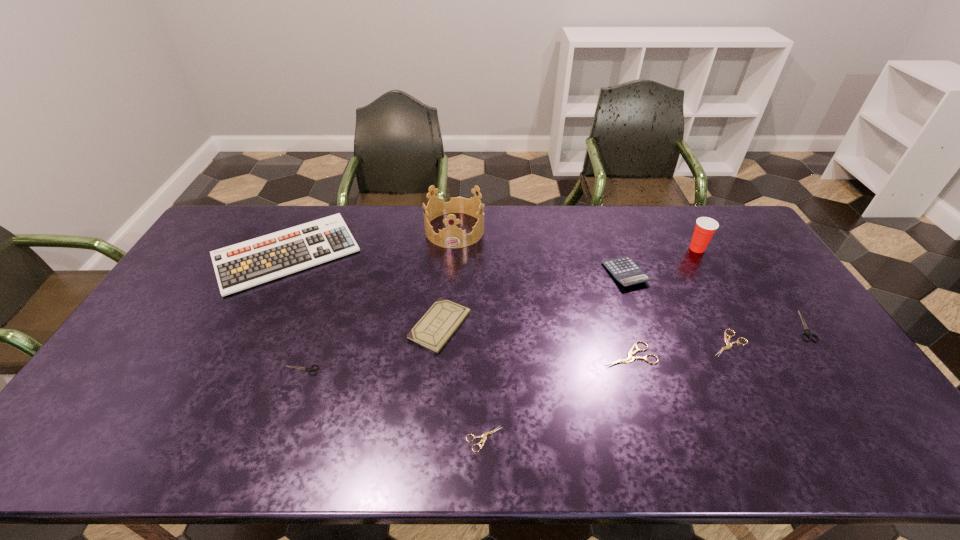
The height and width of the screenshot is (540, 960). In order to click on tiara in this screenshot , I will do pyautogui.click(x=453, y=237).

Find the location of `Dixie cup`. Dixie cup is located at coordinates (705, 227).

Locate an element on the screen. The width and height of the screenshot is (960, 540). red Dixie cup is located at coordinates coord(705,227).

Where is `the third tallest object`? This screenshot has height=540, width=960. the third tallest object is located at coordinates (243, 265).

Image resolution: width=960 pixels, height=540 pixels. I want to click on white computer keyboard, so click(243, 265).

Image resolution: width=960 pixels, height=540 pixels. I want to click on calculator, so click(623, 269).

At what (x,y) coordinates should I click in order to perform the action: click on checkbook. Please return your answer as a coordinate pair (x, y). This screenshot has height=540, width=960. Looking at the image, I should click on (433, 330).

The image size is (960, 540). I want to click on the farther black shears, so [807, 332].

You are a GUI agent. You are given a task and a screenshot of the screen. Output one action in this format:
    pyautogui.click(x=<x>, y=<y>)
    Task: Click on the rightmost object
    The height and width of the screenshot is (540, 960).
    Given the screenshot: What is the action you would take?
    pyautogui.click(x=807, y=332)

Identify the location of the second beige shears from right to left. (630, 358).